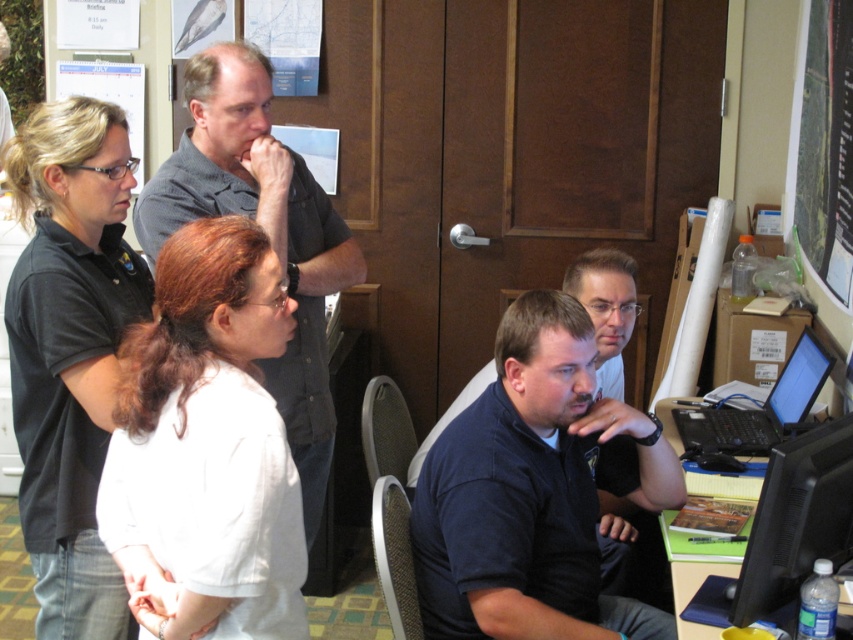
Between dark blue shirt at center and gray shirt at upper center, which one has less height?

dark blue shirt at center

Is dark blue shirt at center wider than gray shirt at upper center?

Correct, the width of dark blue shirt at center exceeds that of gray shirt at upper center.

Between point (521, 563) and point (271, 394), which one is positioned behind?

The point (271, 394) is behind.

The width and height of the screenshot is (853, 640). What are the coordinates of `dark blue shirt at center` in the screenshot? It's located at (527, 492).

Looking at this image, who is higher up, black shirt at upper left or black plastic laptop at right?

black shirt at upper left is higher up.

I want to click on black shirt at upper left, so click(70, 349).

Image resolution: width=853 pixels, height=640 pixels. I want to click on black shirt at upper left, so click(70, 349).

Find the location of `black shirt at upper left`. black shirt at upper left is located at coordinates (70, 349).

Where is `white matte shirt at left`? white matte shirt at left is located at coordinates point(206,449).

How distant is white matte shirt at left from black shirt at upper left?

A distance of 14.14 inches exists between white matte shirt at left and black shirt at upper left.

Find the location of a particular element. The width and height of the screenshot is (853, 640). white matte shirt at left is located at coordinates (206, 449).